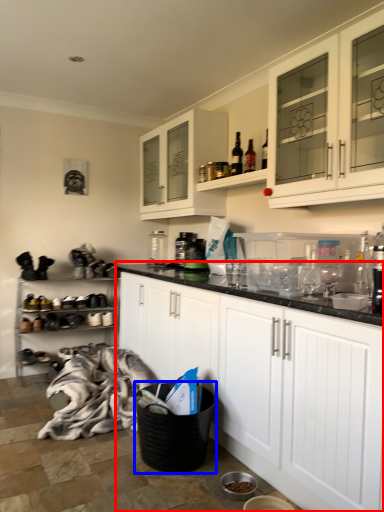
Question: Among these objects, which one is nearest to the camera, cabinetry (highlighted by a red box) or laundry basket (highlighted by a blue box)?

Choices:
 (A) cabinetry
 (B) laundry basket

Answer: (A)